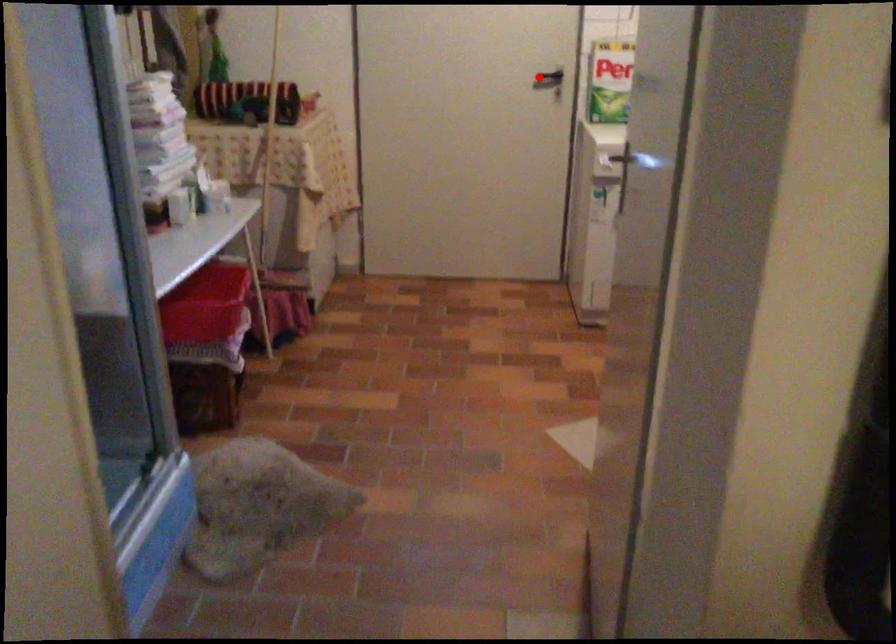
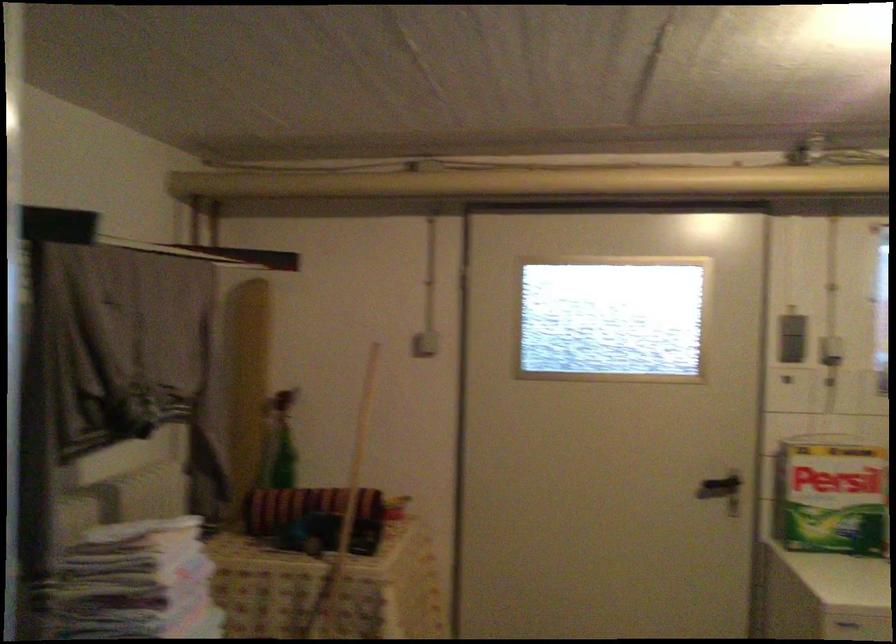
Find the pixel in the second image that matches the highlighted location in the first image.

(720, 488)